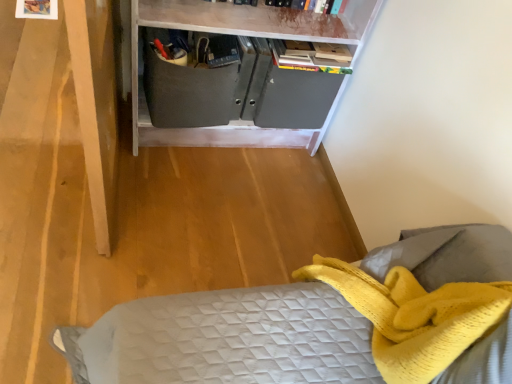
Question: Is matte gray cabinet at center inside the boundaries of matte gray cabinet at center, or outside?

Choices:
 (A) outside
 (B) inside

Answer: (B)

Question: In the image, is matte gray cabinet at center positioned in front of or behind matte gray cabinet at center?

Choices:
 (A) behind
 (B) front

Answer: (A)

Question: From a real-world perspective, is matte gray cabinet at center positioned above or below matte gray cabinet at center?

Choices:
 (A) above
 (B) below

Answer: (B)

Question: Does point (290, 18) appear closer or farther from the camera than point (158, 74)?

Choices:
 (A) farther
 (B) closer

Answer: (A)

Question: Looking at the image, does matte gray cabinet at center seem bigger or smaller compared to matte gray cabinet at center?

Choices:
 (A) small
 (B) big

Answer: (B)

Question: Considering their positions, is matte gray cabinet at center located in front of or behind matte gray cabinet at center?

Choices:
 (A) behind
 (B) front

Answer: (B)

Question: From their relative heights in the image, would you say matte gray cabinet at center is taller or shorter than matte gray cabinet at center?

Choices:
 (A) short
 (B) tall

Answer: (B)